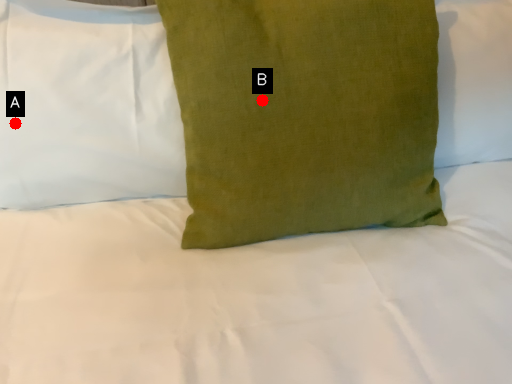
Question: Two points are circled on the image, labeled by A and B beside each circle. Which point is farther from the camera taking this photo?

Choices:
 (A) A is further
 (B) B is further

Answer: (A)